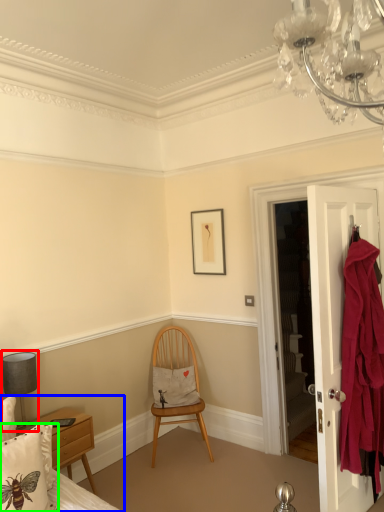
Question: Based on their relative distances, which object is farther from lamp (highlighted by a red box)? Choose from bed (highlighted by a blue box) and pillow (highlighted by a green box).

Choices:
 (A) bed
 (B) pillow

Answer: (B)